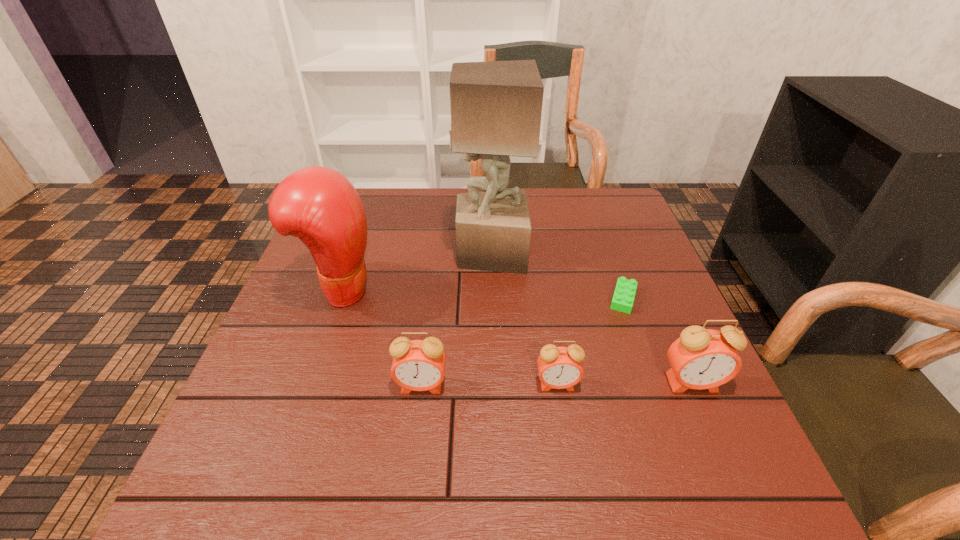
In order to click on free space located 0.080m on the face of the shortest alarm clock in this screenshot , I will do `click(564, 431)`.

Image resolution: width=960 pixels, height=540 pixels. I want to click on vacant space situated 0.100m on the face of the rightmost alarm clock, so click(718, 444).

At what (x,y) coordinates should I click in order to perform the action: click on vacant area situated 0.170m on the front-facing side of the sculpture. Please return your answer as a coordinate pair (x, y). Looking at the image, I should click on pos(392,253).

Where is `free space located on the front-facing side of the sculpture`? This screenshot has height=540, width=960. free space located on the front-facing side of the sculpture is located at coordinates (429, 253).

At what (x,y) coordinates should I click in order to perform the action: click on vacant region located on the front-facing side of the sculpture. Please return your answer as a coordinate pair (x, y). Looking at the image, I should click on (369, 253).

Find the location of a particular element. The width and height of the screenshot is (960, 540). free space located on the striking surface of the leftmost object is located at coordinates (453, 290).

Locate an element on the screen. free space located on the back of the shortest object is located at coordinates pos(609,256).

Find the location of a particular element. The width and height of the screenshot is (960, 540). object that is at the left edge is located at coordinates (319, 205).

Image resolution: width=960 pixels, height=540 pixels. I want to click on alarm clock located at the right edge, so click(701, 358).

Identify the location of Lego present at the right edge. (623, 298).